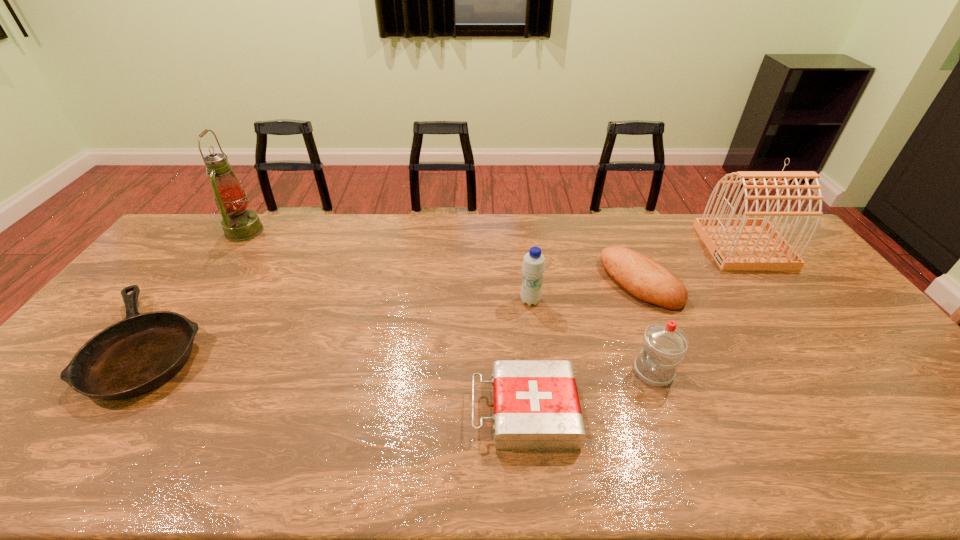
Identify the location of unoccupied area between the left water bottle and the shortest object. (340, 323).

The height and width of the screenshot is (540, 960). Identify the location of vacant space that is in between the bread and the frying pan. (395, 314).

Where is `vacant area that lies between the first-aid kit and the oil lamp`? The image size is (960, 540). vacant area that lies between the first-aid kit and the oil lamp is located at coordinates (385, 321).

Locate an element on the screen. This screenshot has width=960, height=540. free space that is in between the first-aid kit and the oil lamp is located at coordinates (385, 321).

At what (x,y) coordinates should I click in order to perform the action: click on unoccupied position between the first-aid kit and the left water bottle. Please return your answer as a coordinate pair (x, y). The width and height of the screenshot is (960, 540). Looking at the image, I should click on (527, 356).

Identify the location of free spot between the shortest object and the second shortest object. (337, 379).

At what (x,y) coordinates should I click in order to perform the action: click on free space between the birdcage and the oil lamp. Please return your answer as a coordinate pair (x, y). Image resolution: width=960 pixels, height=540 pixels. Looking at the image, I should click on (494, 239).

Identify the location of free space between the nearer water bottle and the oil lamp. Image resolution: width=960 pixels, height=540 pixels. (449, 301).

The width and height of the screenshot is (960, 540). Find the location of `free spot between the oil lamp and the rightmost object`. free spot between the oil lamp and the rightmost object is located at coordinates (494, 239).

Choose which object is the sixth nearest neighbor to the right water bottle. Please provide its 2D coordinates. Your answer should be formatted as a tuple, i.e. [(x, y)], where the tuple contains the x and y coordinates of a point satisfying the conditions above.

[(239, 224)]